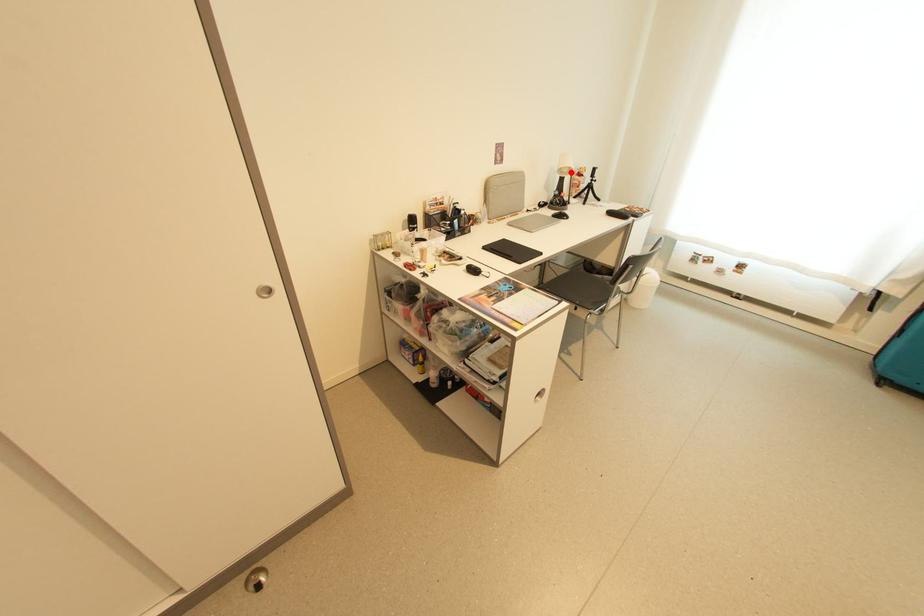
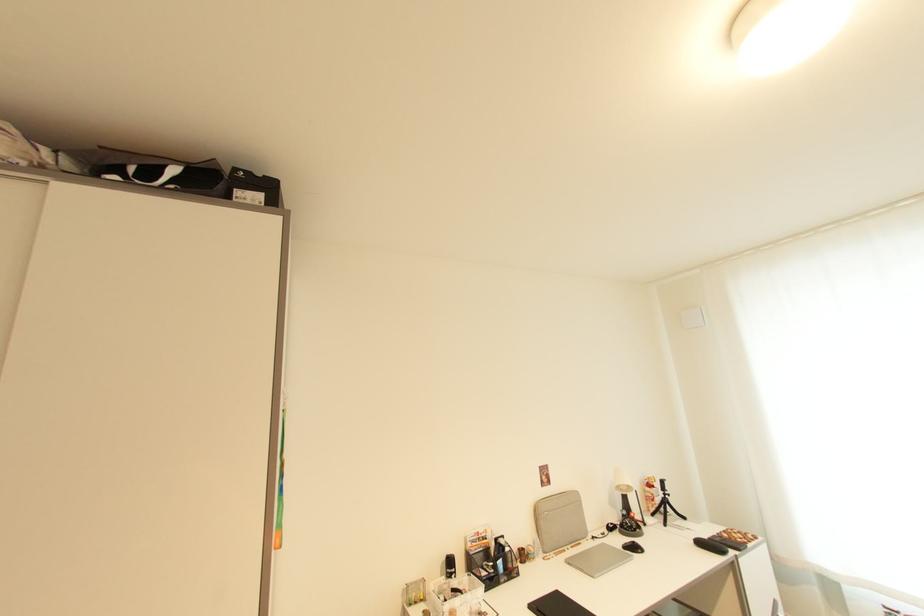
Locate, in the second image, the point that corresponds to the highlighted location in the first image.

(629, 490)